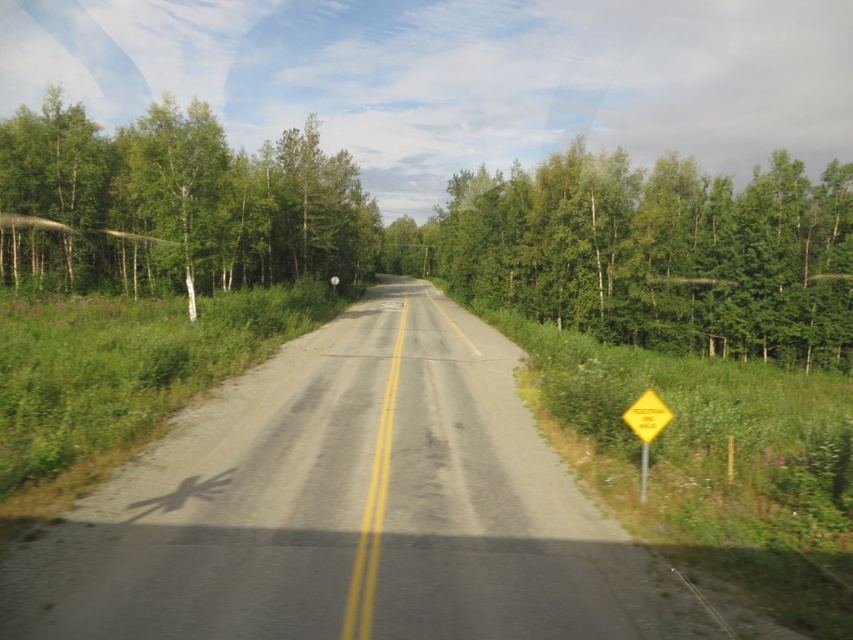
Is yellow diamond-shaped warning sign at right taller than yellow reflective diamond at right?

Yes.

Can you confirm if yellow diamond-shaped warning sign at right is smaller than yellow reflective diamond at right?

Incorrect, yellow diamond-shaped warning sign at right is not smaller in size than yellow reflective diamond at right.

Is point (656, 400) positioned behind point (641, 436)?

Yes, it is.

Locate an element on the screen. Image resolution: width=853 pixels, height=640 pixels. yellow diamond-shaped warning sign at right is located at coordinates (646, 428).

Is point (534, 284) farther from viewer compared to point (213, 225)?

That is True.

Does green leafy trees at center appear on the left side of green leafy tree at left?

In fact, green leafy trees at center is to the right of green leafy tree at left.

Find the location of `green leafy trees at center`. green leafy trees at center is located at coordinates (660, 253).

Which is below, green leafy trees at center or yellow reflective diamond at right?

yellow reflective diamond at right is below.

Does green leafy trees at center have a larger size compared to yellow reflective diamond at right?

Indeed, green leafy trees at center has a larger size compared to yellow reflective diamond at right.

Between point (584, 196) and point (639, 435), which one is positioned in front?

Positioned in front is point (639, 435).

You are a GUI agent. You are given a task and a screenshot of the screen. Output one action in this format:
    pyautogui.click(x=<x>, y=<y>)
    Task: Click on the green leafy trees at center
    
    Given the screenshot: What is the action you would take?
    pyautogui.click(x=660, y=253)